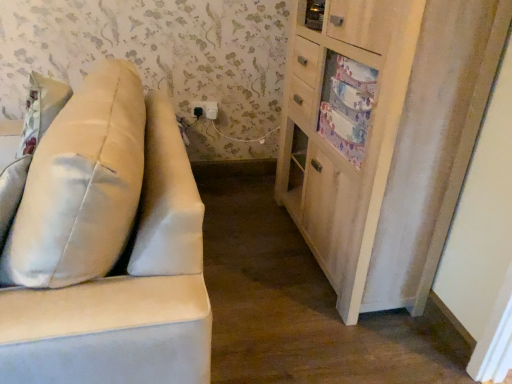
Question: Is suede-like beige sofa at left completely or partially outside of satin beige pillow at left?

Choices:
 (A) yes
 (B) no

Answer: (A)

Question: Can you confirm if suede-like beige sofa at left is shorter than satin beige pillow at left?

Choices:
 (A) yes
 (B) no

Answer: (B)

Question: Considering the relative positions of suede-like beige sofa at left and satin beige pillow at left in the image provided, is suede-like beige sofa at left to the right of satin beige pillow at left from the viewer's perspective?

Choices:
 (A) no
 (B) yes

Answer: (A)

Question: Does suede-like beige sofa at left have a lesser width compared to satin beige pillow at left?

Choices:
 (A) yes
 (B) no

Answer: (B)

Question: Can you confirm if suede-like beige sofa at left is smaller than satin beige pillow at left?

Choices:
 (A) no
 (B) yes

Answer: (A)

Question: From a real-world perspective, is suede-like beige sofa at left on satin beige pillow at left?

Choices:
 (A) yes
 (B) no

Answer: (B)

Question: Considering the relative sizes of suede-like beige sofa at left and satin beige pillow at left in the image provided, is suede-like beige sofa at left taller than satin beige pillow at left?

Choices:
 (A) no
 (B) yes

Answer: (B)

Question: Is suede-like beige sofa at left looking in the opposite direction of satin beige pillow at left?

Choices:
 (A) yes
 (B) no

Answer: (A)

Question: Is satin beige pillow at left surrounded by suede-like beige sofa at left?

Choices:
 (A) yes
 (B) no

Answer: (A)

Question: From the image's perspective, would you say suede-like beige sofa at left is shown under satin beige pillow at left?

Choices:
 (A) yes
 (B) no

Answer: (A)

Question: Is suede-like beige sofa at left not near satin beige pillow at left?

Choices:
 (A) yes
 (B) no

Answer: (B)

Question: From the image's perspective, does suede-like beige sofa at left appear higher than satin beige pillow at left?

Choices:
 (A) yes
 (B) no

Answer: (B)

Question: Considering the relative sizes of satin beige pillow at left and suede-like beige sofa at left in the image provided, is satin beige pillow at left wider than suede-like beige sofa at left?

Choices:
 (A) yes
 (B) no

Answer: (B)